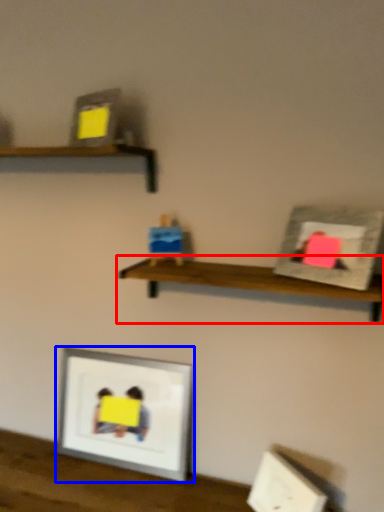
Question: Which point is closer to the camera, shelf (highlighted by a red box) or picture frame (highlighted by a blue box)?

Choices:
 (A) shelf
 (B) picture frame

Answer: (A)